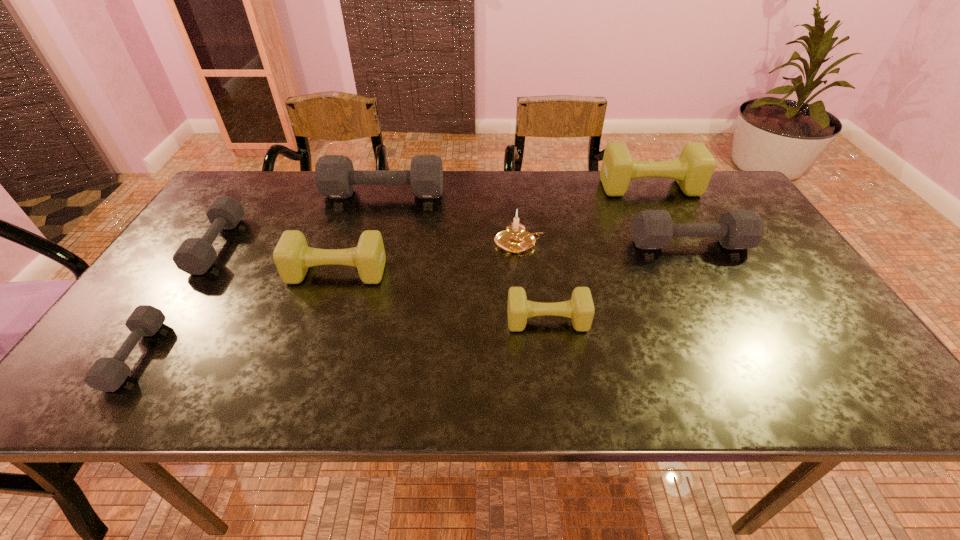
In order to click on dumbbell that stands as the fifth closest to the nearest olive dumbbell in this screenshot , I will do `click(195, 256)`.

Where is `olive dumbbell that is the second nearest to the second olive dumbbell from left to right`? Image resolution: width=960 pixels, height=540 pixels. olive dumbbell that is the second nearest to the second olive dumbbell from left to right is located at coordinates (693, 170).

Where is `the second closest olive dumbbell to the candle holder`? the second closest olive dumbbell to the candle holder is located at coordinates (693, 170).

The width and height of the screenshot is (960, 540). What are the coordinates of `the second closest gray dumbbell to the second smallest gray dumbbell` in the screenshot? It's located at (335, 177).

Locate an element on the screen. This screenshot has height=540, width=960. gray dumbbell that is the closest one to the shortest dumbbell is located at coordinates (195, 256).

I want to click on blank area in the image that satisfies the following two spatial constraints: 1. on the back side of the smallest gray dumbbell; 2. on the right side of the rightmost olive dumbbell, so click(250, 187).

Locate an element on the screen. The width and height of the screenshot is (960, 540). vacant region that satisfies the following two spatial constraints: 1. on the back side of the smallest olive dumbbell; 2. on the left side of the smallest gray dumbbell is located at coordinates (158, 321).